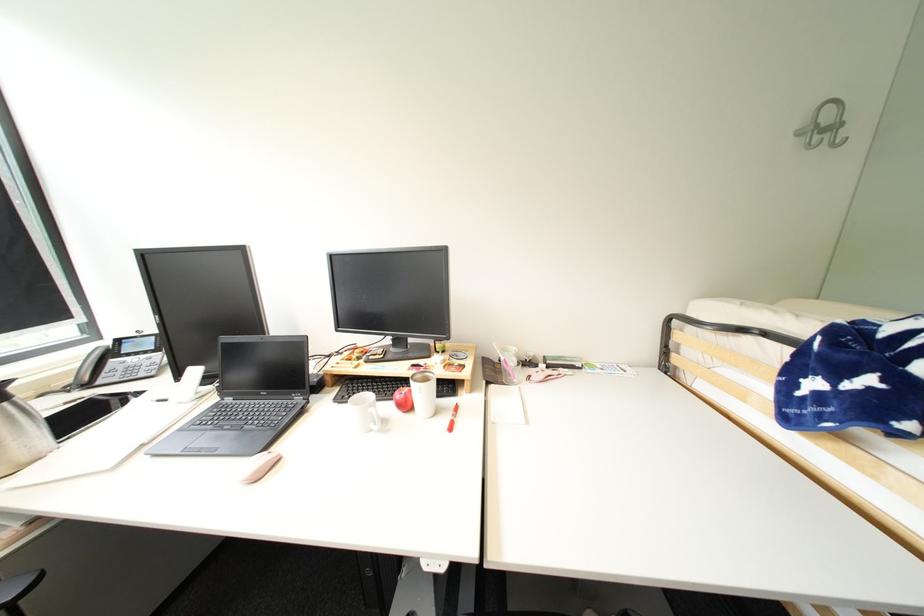
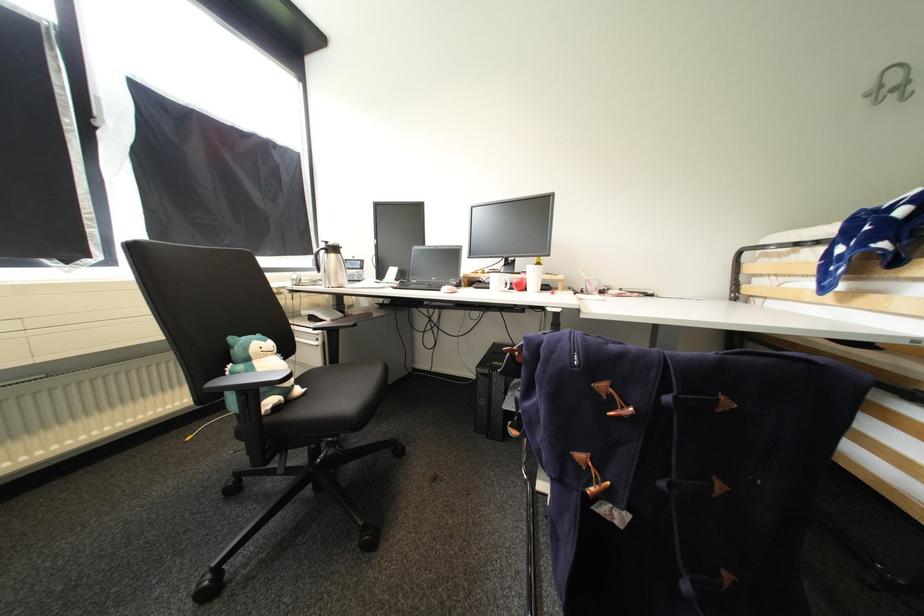
The point at (841, 128) is marked in the first image. Where is the corresponding point in the second image?

(912, 84)